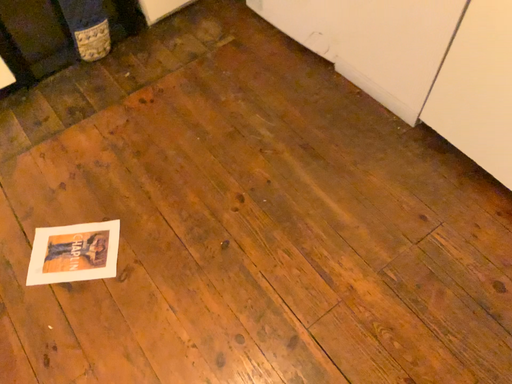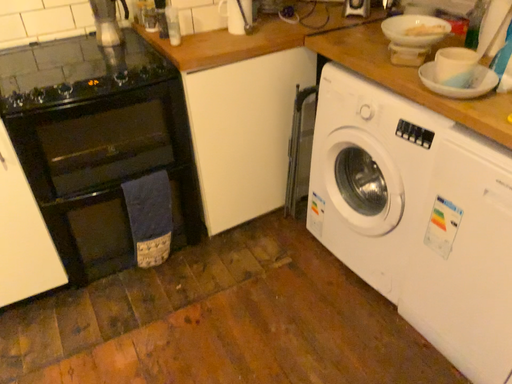
Question: How did the camera likely rotate when shooting the video?

Choices:
 (A) rotated upward
 (B) rotated downward

Answer: (A)